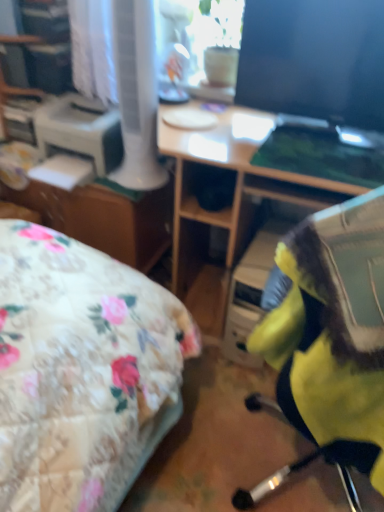
Question: Considering the relative sizes of wooden desk at center and yellow fabric chair at center in the image provided, is wooden desk at center shorter than yellow fabric chair at center?

Choices:
 (A) yes
 (B) no

Answer: (B)

Question: Does wooden desk at center have a larger size compared to yellow fabric chair at center?

Choices:
 (A) no
 (B) yes

Answer: (B)

Question: Is yellow fabric chair at center located within wooden desk at center?

Choices:
 (A) yes
 (B) no

Answer: (B)

Question: Is wooden desk at center directly adjacent to yellow fabric chair at center?

Choices:
 (A) no
 (B) yes

Answer: (A)

Question: Is wooden desk at center far from yellow fabric chair at center?

Choices:
 (A) yes
 (B) no

Answer: (B)

Question: Considering their positions, is matte glass window screen at upper center located in front of or behind matte black monitor at upper right?

Choices:
 (A) behind
 (B) front

Answer: (A)

Question: In terms of size, does matte glass window screen at upper center appear bigger or smaller than matte black monitor at upper right?

Choices:
 (A) small
 (B) big

Answer: (B)

Question: From the image's perspective, relative to matte black monitor at upper right, is matte glass window screen at upper center above or below?

Choices:
 (A) above
 (B) below

Answer: (A)

Question: From a real-world perspective, is matte glass window screen at upper center positioned above or below matte black monitor at upper right?

Choices:
 (A) below
 (B) above

Answer: (A)

Question: In terms of size, does matte black monitor at upper right appear bigger or smaller than yellow fabric chair at center?

Choices:
 (A) big
 (B) small

Answer: (B)

Question: Is point (246, 86) positioned closer to the camera than point (296, 320)?

Choices:
 (A) farther
 (B) closer

Answer: (A)

Question: From a real-world perspective, is matte black monitor at upper right positioned above or below yellow fabric chair at center?

Choices:
 (A) below
 (B) above

Answer: (B)

Question: Is matte black monitor at upper right taller or shorter than yellow fabric chair at center?

Choices:
 (A) tall
 (B) short

Answer: (B)

Question: In terms of height, does matte brown file cabinet at center look taller or shorter compared to yellow fabric chair at center?

Choices:
 (A) tall
 (B) short

Answer: (B)

Question: Considering their positions, is matte brown file cabinet at center located in front of or behind yellow fabric chair at center?

Choices:
 (A) front
 (B) behind

Answer: (B)